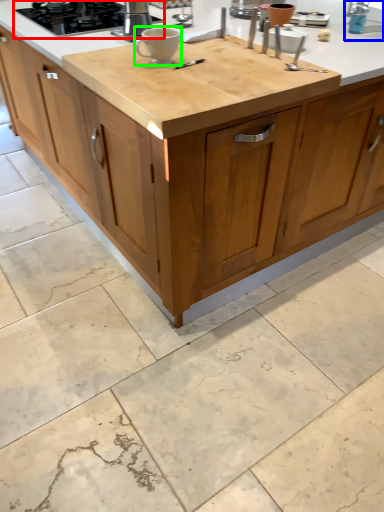
Question: Which object is positioned farthest from gas stove (highlighted by a red box)? Select from faucet (highlighted by a blue box) and coffee cup (highlighted by a green box).

Choices:
 (A) faucet
 (B) coffee cup

Answer: (A)